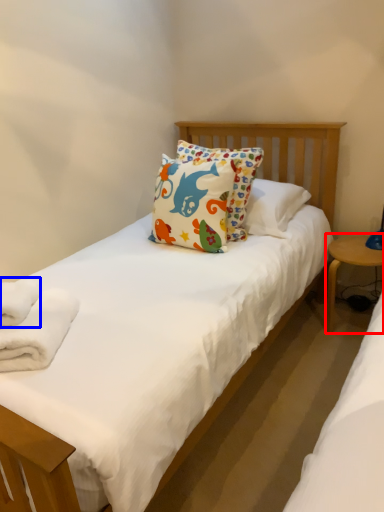
Question: Among these objects, which one is nearest to the camera, table (highlighted by a red box) or bath towel (highlighted by a blue box)?

Choices:
 (A) table
 (B) bath towel

Answer: (B)